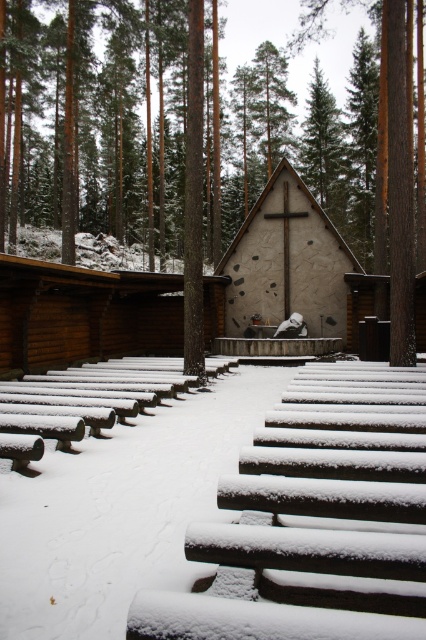
Looking at this image, which is above, snow-covered wood at center or wooden bench at center?

Positioned higher is wooden bench at center.

Identify the location of snow-covered wood at center. Image resolution: width=426 pixels, height=640 pixels. (313, 520).

Can you confirm if brown wooden cabin at center is bigger than stucco cross at center?

Indeed, brown wooden cabin at center has a larger size compared to stucco cross at center.

Does point (100, 285) come behind point (281, 195)?

No, (100, 285) is closer to viewer.

Find the location of a particular element. The width and height of the screenshot is (426, 640). brown wooden cabin at center is located at coordinates (83, 314).

Between point (288, 260) and point (63, 417), which one is positioned behind?

The point (288, 260) is behind.

The image size is (426, 640). In order to click on stucco cross at center in this screenshot , I will do `click(287, 262)`.